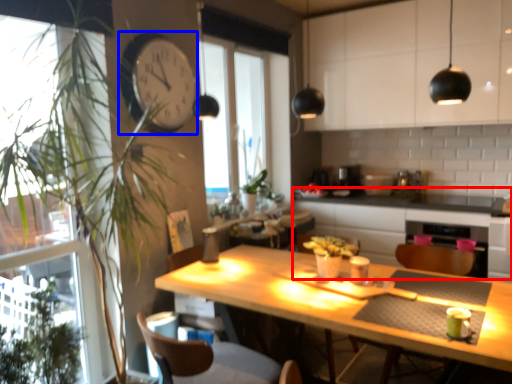
Question: Among these objects, which one is nearest to the camera, counter (highlighted by a red box) or clock (highlighted by a blue box)?

Choices:
 (A) counter
 (B) clock

Answer: (B)